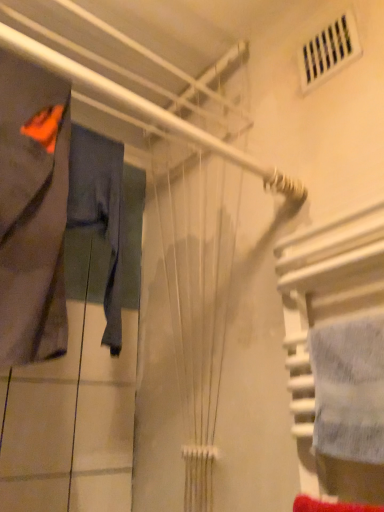
Question: Is white textured towel at right oriented away from matte gray fabric at left, positioned as the 1th clothing in front-to-back order?

Choices:
 (A) yes
 (B) no

Answer: (B)

Question: Is white textured towel at right not close to matte gray fabric at left, the second clothing viewed from the back?

Choices:
 (A) yes
 (B) no

Answer: (B)

Question: Considering the relative sizes of white textured towel at right and matte gray fabric at left, the second clothing viewed from the back, in the image provided, is white textured towel at right shorter than matte gray fabric at left, the second clothing viewed from the back,?

Choices:
 (A) yes
 (B) no

Answer: (A)

Question: Can you confirm if white textured towel at right is taller than matte gray fabric at left, positioned as the 1th clothing in front-to-back order?

Choices:
 (A) yes
 (B) no

Answer: (B)

Question: Can you confirm if white textured towel at right is bigger than matte gray fabric at left, the second clothing viewed from the back?

Choices:
 (A) no
 (B) yes

Answer: (A)

Question: Is white textured towel at right next to matte gray fabric at left, the second clothing viewed from the back, and touching it?

Choices:
 (A) no
 (B) yes

Answer: (A)

Question: Would you consider white textured towel at right to be distant from denim pants at left, placed as the first clothing when sorted from back to front?

Choices:
 (A) no
 (B) yes

Answer: (A)

Question: Considering the relative sizes of white textured towel at right and denim pants at left, placed as the first clothing when sorted from back to front, in the image provided, is white textured towel at right taller than denim pants at left, placed as the first clothing when sorted from back to front,?

Choices:
 (A) no
 (B) yes

Answer: (A)

Question: Is white textured towel at right at the left side of denim pants at left, which is the 2th clothing from front to back?

Choices:
 (A) no
 (B) yes

Answer: (A)

Question: From the image's perspective, is white textured towel at right on top of denim pants at left, which is the 2th clothing from front to back?

Choices:
 (A) no
 (B) yes

Answer: (A)

Question: Does white textured towel at right come behind denim pants at left, placed as the first clothing when sorted from back to front?

Choices:
 (A) no
 (B) yes

Answer: (A)

Question: Is white textured towel at right positioned with its back to denim pants at left, which is the 2th clothing from front to back?

Choices:
 (A) yes
 (B) no

Answer: (B)

Question: Does matte gray fabric at left, the second clothing viewed from the back, appear on the right side of denim pants at left, which is the 2th clothing from front to back?

Choices:
 (A) no
 (B) yes

Answer: (A)